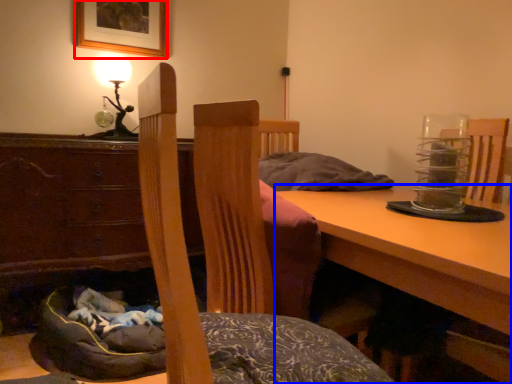
Question: Which object is further to the camera taking this photo, picture frame (highlighted by a red box) or table (highlighted by a blue box)?

Choices:
 (A) picture frame
 (B) table

Answer: (A)